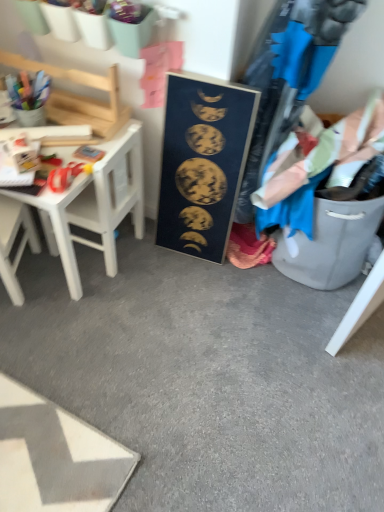
Question: Is blue cotton shirt at right to the left or to the right of white plastic chair at left in the image?

Choices:
 (A) left
 (B) right

Answer: (B)

Question: In the image, is blue cotton shirt at right positioned in front of or behind white plastic chair at left?

Choices:
 (A) front
 (B) behind

Answer: (A)

Question: Estimate the real-world distances between objects in this image. Which object is closer to the white plastic chair at left?

Choices:
 (A) white wood table at left
 (B) gold metallic moon phases at center
 (C) blue cotton shirt at right

Answer: (A)

Question: Considering the real-world distances, which object is closest to the white plastic chair at left?

Choices:
 (A) white wood table at left
 (B) gold metallic moon phases at center
 (C) blue cotton shirt at right

Answer: (A)